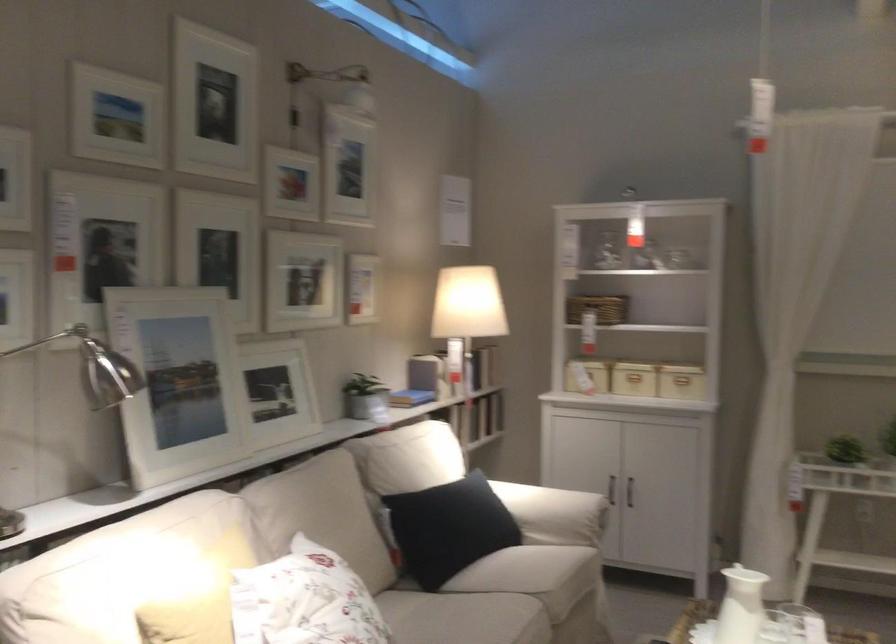
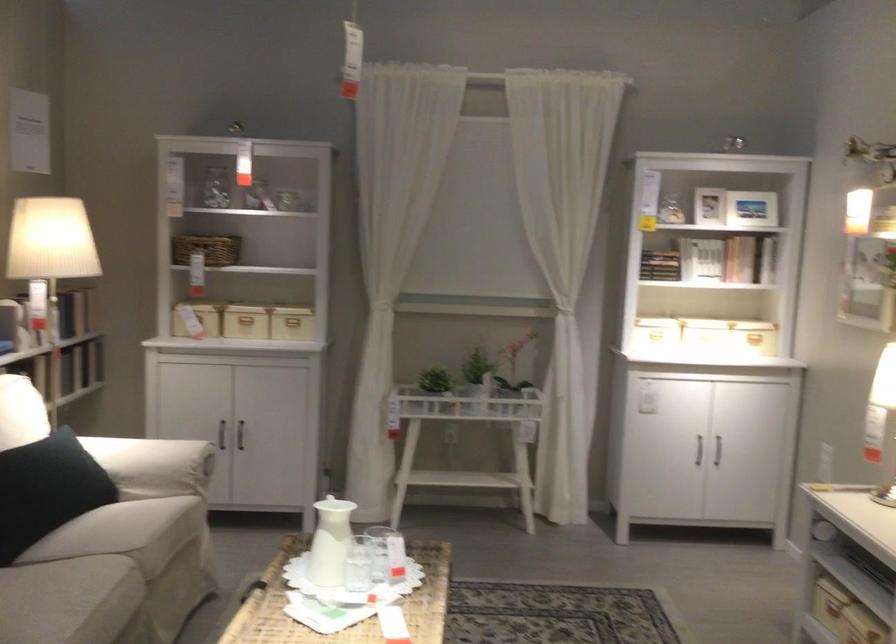
Find the pixel in the second image that matches (x=635, y=368) in the first image.

(245, 319)